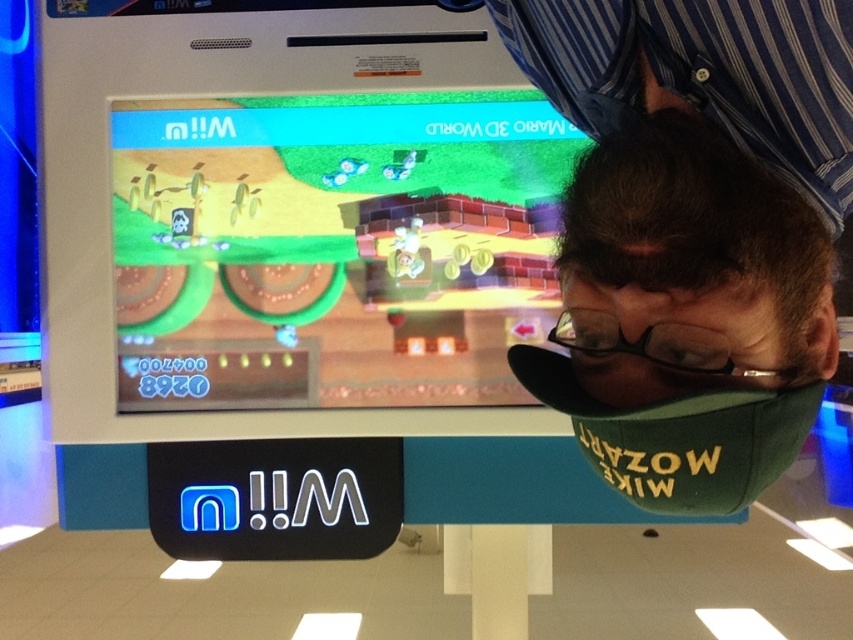
Question: Which point is closer to the camera taking this photo?

Choices:
 (A) coord(619,340)
 (B) coord(720,291)

Answer: (B)

Question: Considering the real-world distances, which object is closest to the matte green platform at center?

Choices:
 (A) green fabric cap at center
 (B) black plastic glasses at center

Answer: (A)

Question: Observing the image, what is the correct spatial positioning of green fabric cap at center in reference to black plastic glasses at center?

Choices:
 (A) right
 (B) left

Answer: (A)

Question: Is matte green platform at center further to the viewer compared to black plastic glasses at center?

Choices:
 (A) yes
 (B) no

Answer: (A)

Question: Where is green fabric cap at center located in relation to matte green platform at center in the image?

Choices:
 (A) above
 (B) below

Answer: (A)

Question: Estimate the real-world distances between objects in this image. Which object is farther from the green fabric cap at center?

Choices:
 (A) matte green platform at center
 (B) black plastic glasses at center

Answer: (A)